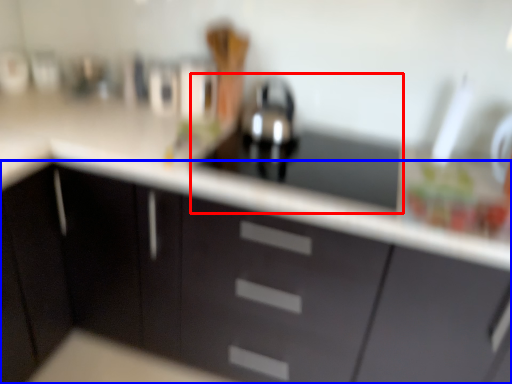
Question: Which object is further to the camera taking this photo, sink (highlighted by a red box) or cabinetry (highlighted by a blue box)?

Choices:
 (A) sink
 (B) cabinetry

Answer: (A)